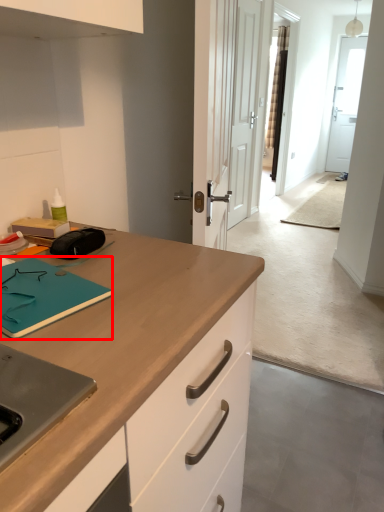
Question: Considering the relative positions of notepad (annotated by the red box) and door in the image provided, where is notepad (annotated by the red box) located with respect to the staircase?

Choices:
 (A) right
 (B) left

Answer: (B)